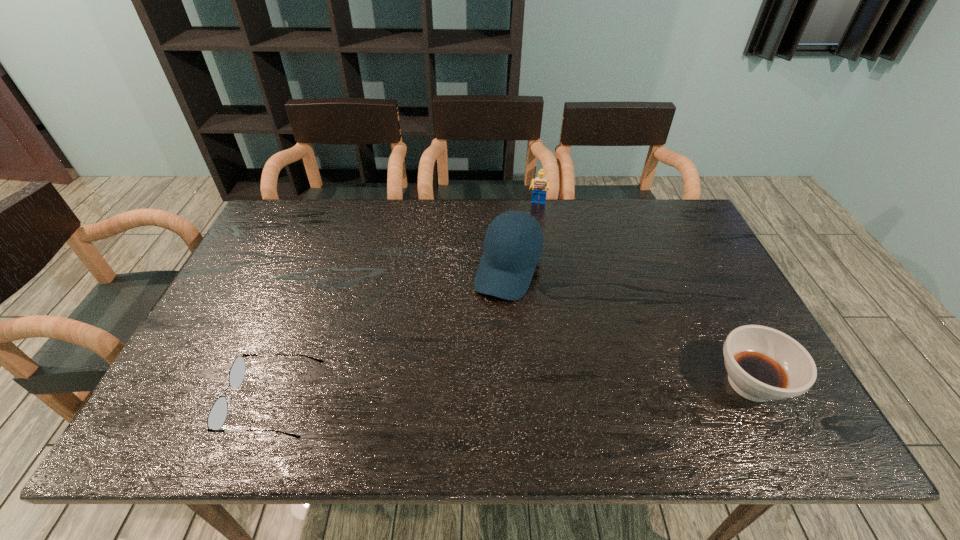
This screenshot has height=540, width=960. In order to click on vacant space at the far left corner of the desktop in this screenshot , I will do `click(282, 207)`.

At what (x,y) coordinates should I click in order to perform the action: click on free space between the Lego and the shortest object. Please return your answer as a coordinate pair (x, y). Image resolution: width=960 pixels, height=540 pixels. Looking at the image, I should click on (405, 303).

This screenshot has width=960, height=540. I want to click on vacant space that's between the baseball cap and the rightmost object, so coord(630,326).

The height and width of the screenshot is (540, 960). Find the location of `vacant space that's between the baseball cap and the third tallest object`. vacant space that's between the baseball cap and the third tallest object is located at coordinates (630, 326).

Where is `free space between the spectacles and the farthest object`? free space between the spectacles and the farthest object is located at coordinates (405, 303).

Where is `empty space between the baseball cap and the leftmost object`? empty space between the baseball cap and the leftmost object is located at coordinates (392, 335).

What are the coordinates of `empty space between the soup bowl and the third shortest object` in the screenshot? It's located at [x=644, y=294].

Locate an element on the screen. vacant space in between the shortest object and the soup bowl is located at coordinates (512, 392).

This screenshot has width=960, height=540. In order to click on vacant area that lies between the shortest object and the third shortest object in this screenshot , I will do click(405, 303).

Identify the location of vacant area between the tallest object and the second shortest object. (630, 326).